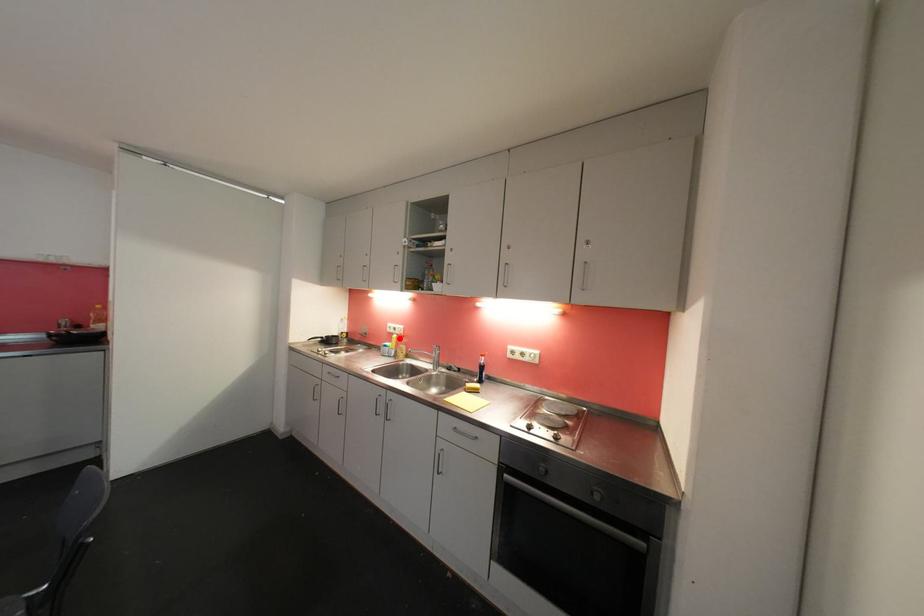
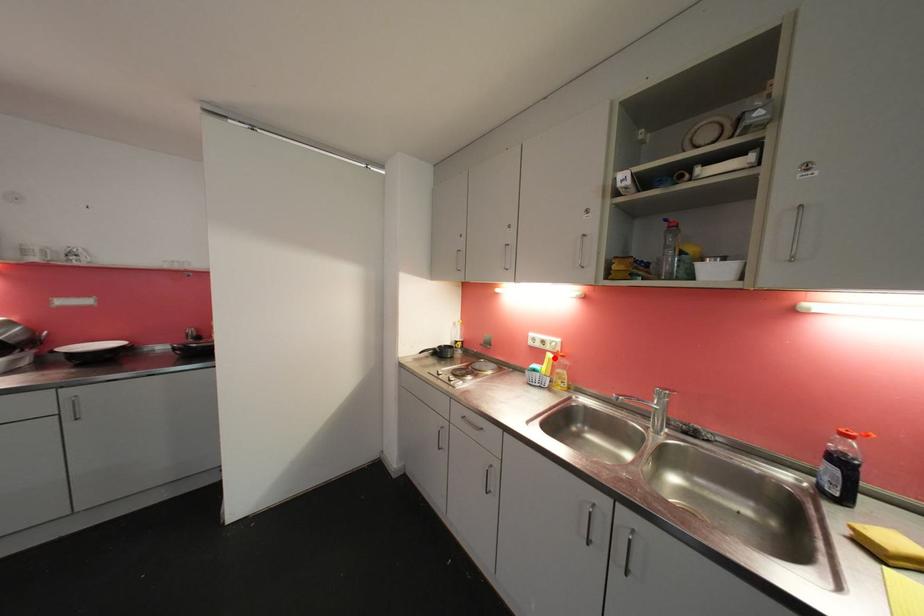
I am providing you with two images of the same scene from different viewpoints. A red point is marked on the first image and another point is marked on the second image. Are the points marked in image1 and image2 representing the same 3D position?

Yes